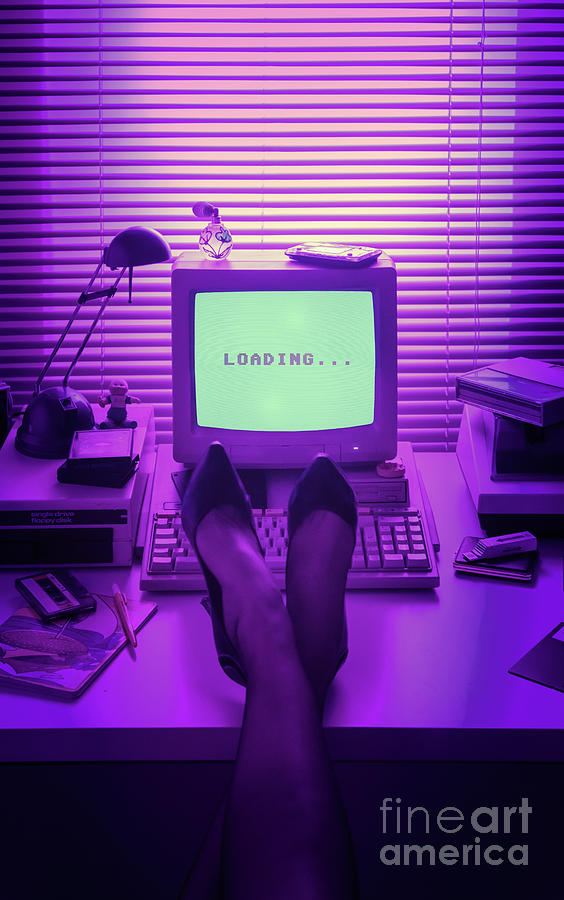
The height and width of the screenshot is (900, 564). In order to click on keyboard in this screenshot , I will do `click(183, 549)`, `click(365, 543)`, `click(396, 546)`.